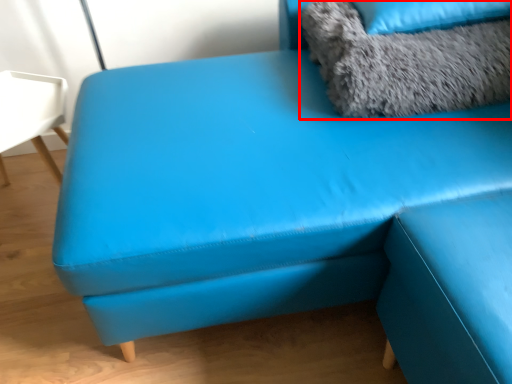
Question: From the image, what is the correct spatial relationship of animal (annotated by the red box) in relation to pillow?

Choices:
 (A) right
 (B) left

Answer: (B)